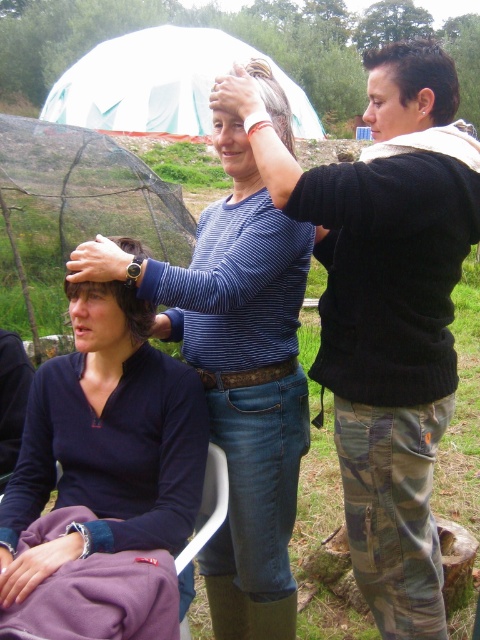
Is point (226, 200) closer to viewer compared to point (88, 472)?

No, (226, 200) is behind (88, 472).

Is blue striped shirt at center further to the viewer compared to dark blue fabric at center?

Yes, it is.

Where is `blue striped shirt at center`? The image size is (480, 640). blue striped shirt at center is located at coordinates (239, 378).

At what (x,y) coordinates should I click in order to perform the action: click on blue striped shirt at center. Please return your answer as a coordinate pair (x, y). Looking at the image, I should click on (239, 378).

Is white fabric tent at upper center bigger than purple fabric folding chair at lower left?

Yes.

Is white fabric tent at upper center closer to camera compared to purple fabric folding chair at lower left?

No.

The image size is (480, 640). Describe the element at coordinates (162, 84) in the screenshot. I see `white fabric tent at upper center` at that location.

Where is `white fabric tent at upper center`? The height and width of the screenshot is (640, 480). white fabric tent at upper center is located at coordinates (162, 84).

Describe the element at coordinates (385, 308) in the screenshot. I see `blue striped sweater at upper center` at that location.

Who is taller, blue striped sweater at upper center or dark blue fabric at center?

blue striped sweater at upper center

You are a GUI agent. You are given a task and a screenshot of the screen. Output one action in this format:
    pyautogui.click(x=<x>, y=<y>)
    Task: Click on the blue striped sweater at upper center
    The width and height of the screenshot is (480, 640).
    Given the screenshot: What is the action you would take?
    pyautogui.click(x=385, y=308)